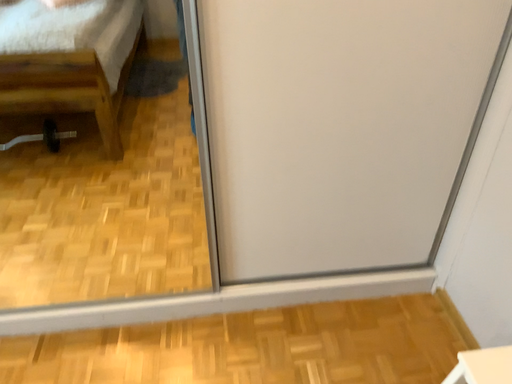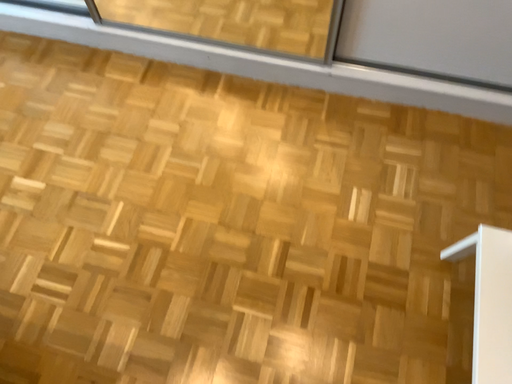
Question: Which way did the camera rotate in the video?

Choices:
 (A) rotated right
 (B) rotated left

Answer: (B)